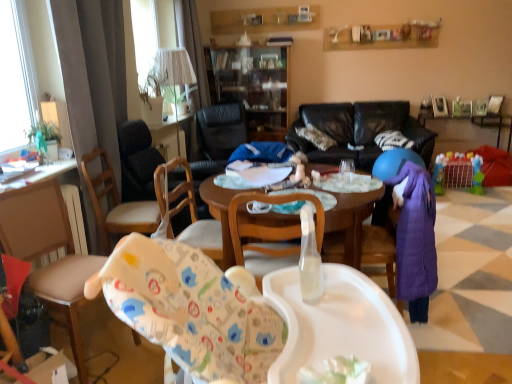
Question: From a real-world perspective, does plastic colorful playpen at right sit lower than wooden chair at left?

Choices:
 (A) no
 (B) yes

Answer: (B)

Question: Is plastic colorful playpen at right not close to wooden chair at left?

Choices:
 (A) no
 (B) yes

Answer: (B)

Question: From the image's perspective, is plastic colorful playpen at right beneath wooden chair at left?

Choices:
 (A) yes
 (B) no

Answer: (B)

Question: From a real-world perspective, is plastic colorful playpen at right located higher than wooden chair at left?

Choices:
 (A) yes
 (B) no

Answer: (B)

Question: Is plastic colorful playpen at right directly adjacent to wooden chair at left?

Choices:
 (A) no
 (B) yes

Answer: (A)

Question: Does plastic colorful playpen at right have a greater width compared to wooden chair at left?

Choices:
 (A) no
 (B) yes

Answer: (A)

Question: Considering the relative sizes of wooden chair at center, acting as the 3th chair starting from the back, and transparent glass cabinet at center in the image provided, is wooden chair at center, acting as the 3th chair starting from the back, thinner than transparent glass cabinet at center?

Choices:
 (A) yes
 (B) no

Answer: (B)

Question: Does wooden chair at center, which is the 2th chair in front-to-back order, have a larger size compared to transparent glass cabinet at center?

Choices:
 (A) yes
 (B) no

Answer: (B)

Question: Does wooden chair at center, acting as the 3th chair starting from the back, contain transparent glass cabinet at center?

Choices:
 (A) yes
 (B) no

Answer: (B)

Question: From a real-world perspective, is wooden chair at center, acting as the 3th chair starting from the back, under transparent glass cabinet at center?

Choices:
 (A) yes
 (B) no

Answer: (A)

Question: Can you confirm if wooden chair at center, which is the 2th chair in front-to-back order, is positioned to the right of transparent glass cabinet at center?

Choices:
 (A) yes
 (B) no

Answer: (A)

Question: From the image's perspective, does wooden chair at center, acting as the 3th chair starting from the back, appear higher than transparent glass cabinet at center?

Choices:
 (A) no
 (B) yes

Answer: (A)

Question: Considering the relative sizes of white fabric lampshade at upper center and black leather chair at center, placed as the 4th chair when sorted from front to back, in the image provided, is white fabric lampshade at upper center shorter than black leather chair at center, placed as the 4th chair when sorted from front to back,?

Choices:
 (A) yes
 (B) no

Answer: (A)